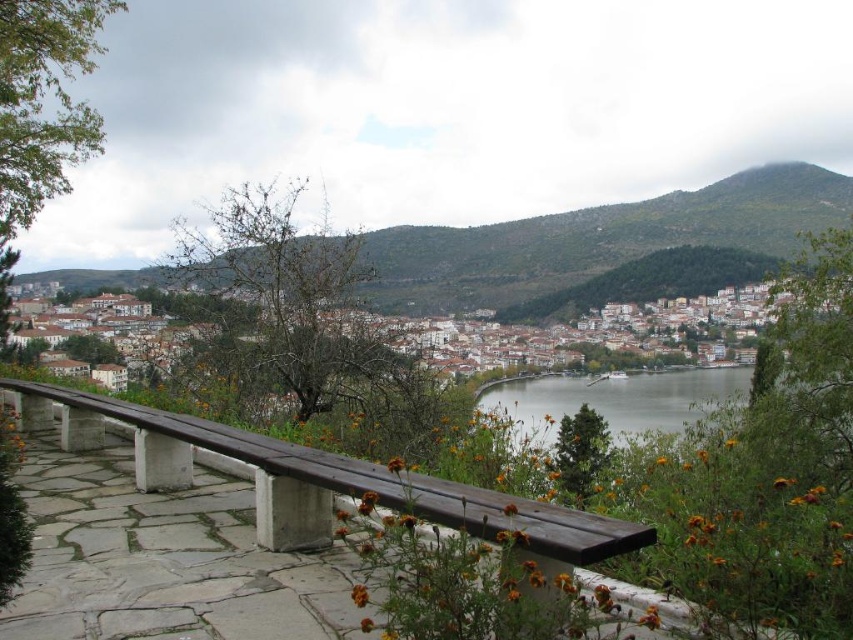
Looking at this image, can you confirm if brown wooden bench at center is thinner than clear water at center?

Yes, brown wooden bench at center is thinner than clear water at center.

Is brown wooden bench at center in front of clear water at center?

Yes, brown wooden bench at center is closer to the viewer.

Who is more distant from viewer, (x=395, y=474) or (x=496, y=403)?

The point (x=496, y=403) is more distant.

You are a GUI agent. You are given a task and a screenshot of the screen. Output one action in this format:
    pyautogui.click(x=<x>, y=<y>)
    Task: Click on the brown wooden bench at center
    This screenshot has width=853, height=640.
    Given the screenshot: What is the action you would take?
    pyautogui.click(x=325, y=483)

Does green grassy hillside at upper center have a greater width compared to brown wooden bench at center?

Indeed, green grassy hillside at upper center has a greater width compared to brown wooden bench at center.

Does green grassy hillside at upper center have a smaller size compared to brown wooden bench at center?

Actually, green grassy hillside at upper center might be larger than brown wooden bench at center.

Locate an element on the screen. green grassy hillside at upper center is located at coordinates (596, 240).

Locate an element on the screen. green grassy hillside at upper center is located at coordinates (596, 240).

Between point (650, 241) and point (850, 394), which one is positioned in front?

Point (850, 394)

Can you confirm if green grassy hillside at upper center is smaller than clear water at center?

No.

Between point (524, 264) and point (839, 394), which one is positioned in front?

Point (839, 394)

In order to click on green grassy hillside at upper center in this screenshot , I will do `click(596, 240)`.